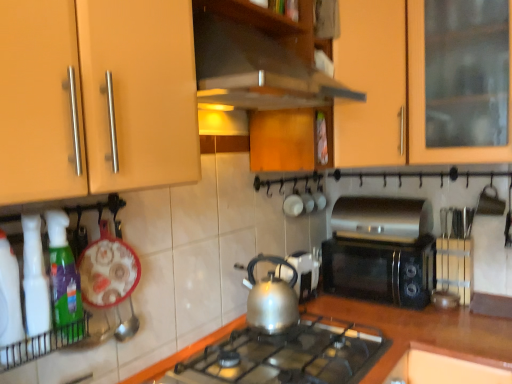
Question: Considering the relative sizes of black plastic microwave at center-right, placed as the first kitchen appliance when sorted from back to front, and translucent plastic spray bottle at lower left in the image provided, is black plastic microwave at center-right, placed as the first kitchen appliance when sorted from back to front, bigger than translucent plastic spray bottle at lower left?

Choices:
 (A) no
 (B) yes

Answer: (B)

Question: Could you tell me if black plastic microwave at center-right, acting as the third kitchen appliance starting from the front, is facing translucent plastic spray bottle at lower left?

Choices:
 (A) no
 (B) yes

Answer: (B)

Question: Can translucent plastic spray bottle at lower left be found inside black plastic microwave at center-right, the first kitchen appliance in the right-to-left sequence?

Choices:
 (A) no
 (B) yes

Answer: (A)

Question: Is black plastic microwave at center-right, acting as the third kitchen appliance starting from the front, smaller than translucent plastic spray bottle at lower left?

Choices:
 (A) yes
 (B) no

Answer: (B)

Question: Can you confirm if black plastic microwave at center-right, the first kitchen appliance in the right-to-left sequence, is taller than translucent plastic spray bottle at lower left?

Choices:
 (A) yes
 (B) no

Answer: (B)

Question: In terms of width, does silver metallic kettle at center, which is the 2th kitchen appliance from left to right, look wider or thinner when compared to translucent green spray bottle at left, which is counted as the first kitchen appliance, starting from the front?

Choices:
 (A) thin
 (B) wide

Answer: (B)

Question: Is point (260, 324) positioned closer to the camera than point (58, 279)?

Choices:
 (A) closer
 (B) farther

Answer: (B)

Question: From the image's perspective, relative to translucent green spray bottle at left, arranged as the 1th kitchen appliance when viewed from the left, is silver metallic kettle at center, which ranks as the 2th kitchen appliance in back-to-front order, above or below?

Choices:
 (A) below
 (B) above

Answer: (A)

Question: From a real-world perspective, is silver metallic kettle at center, which ranks as the 2th kitchen appliance in back-to-front order, above or below translucent green spray bottle at left, which is counted as the first kitchen appliance, starting from the front?

Choices:
 (A) above
 (B) below

Answer: (B)

Question: Would you say translucent green spray bottle at left, arranged as the 1th kitchen appliance when viewed from the left, is inside or outside wooden at center?

Choices:
 (A) inside
 (B) outside

Answer: (B)

Question: Looking at the image, does translucent green spray bottle at left, which is counted as the third kitchen appliance, starting from the right, seem bigger or smaller compared to wooden at center?

Choices:
 (A) big
 (B) small

Answer: (B)

Question: Does point (76, 271) appear closer or farther from the camera than point (326, 304)?

Choices:
 (A) farther
 (B) closer

Answer: (B)

Question: Is translucent green spray bottle at left, marked as the 3th kitchen appliance in a back-to-front arrangement, taller or shorter than wooden at center?

Choices:
 (A) tall
 (B) short

Answer: (B)

Question: In terms of width, does black plastic microwave at center-right, the 3th kitchen appliance positioned from the left, look wider or thinner when compared to silver metallic kettle at center, which is the 2th kitchen appliance from left to right?

Choices:
 (A) thin
 (B) wide

Answer: (B)

Question: Considering their positions, is black plastic microwave at center-right, the 3th kitchen appliance positioned from the left, located in front of or behind silver metallic kettle at center, arranged as the 2th kitchen appliance when viewed from the right?

Choices:
 (A) behind
 (B) front

Answer: (A)